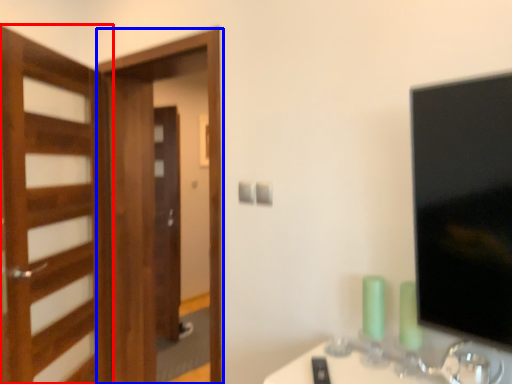
Question: Which object is further to the camera taking this photo, door (highlighted by a red box) or screen door (highlighted by a blue box)?

Choices:
 (A) door
 (B) screen door

Answer: (B)